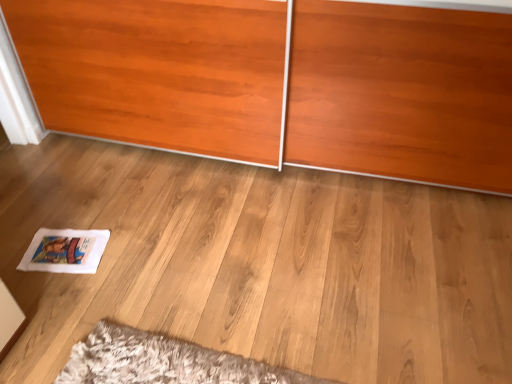
Question: From the image's perspective, relative to matte wood wardrobe at center, is white paper magazine at lower left above or below?

Choices:
 (A) above
 (B) below

Answer: (B)

Question: Considering the positions of white paper magazine at lower left and matte wood wardrobe at center in the image, is white paper magazine at lower left taller or shorter than matte wood wardrobe at center?

Choices:
 (A) tall
 (B) short

Answer: (B)

Question: Is white paper magazine at lower left in front of or behind matte wood wardrobe at center in the image?

Choices:
 (A) front
 (B) behind

Answer: (B)

Question: Is matte wood wardrobe at center situated inside white paper magazine at lower left or outside?

Choices:
 (A) inside
 (B) outside

Answer: (B)

Question: From the image's perspective, is matte wood wardrobe at center positioned above or below white paper magazine at lower left?

Choices:
 (A) above
 (B) below

Answer: (A)

Question: In terms of height, does matte wood wardrobe at center look taller or shorter compared to white paper magazine at lower left?

Choices:
 (A) tall
 (B) short

Answer: (A)

Question: In the image, is matte wood wardrobe at center positioned in front of or behind white paper magazine at lower left?

Choices:
 (A) front
 (B) behind

Answer: (A)